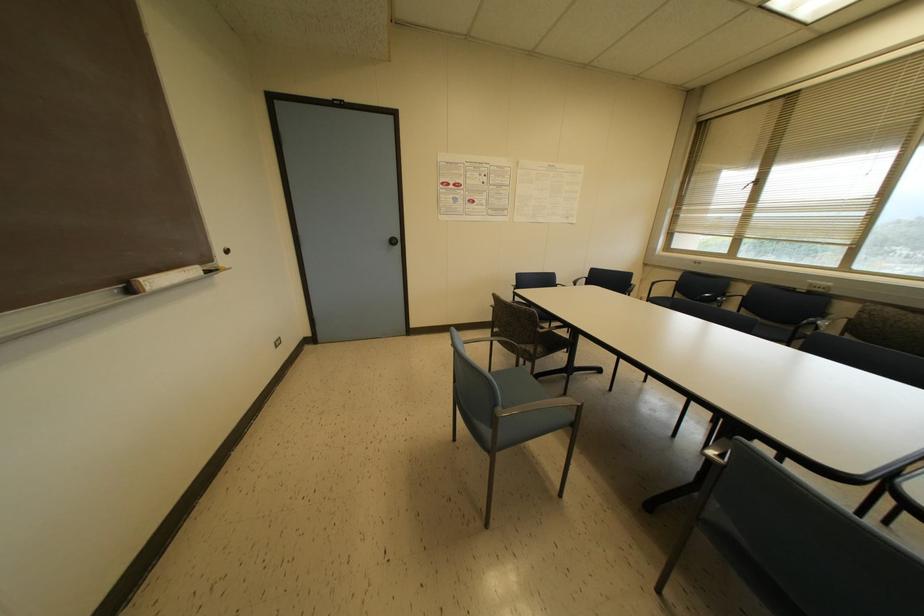
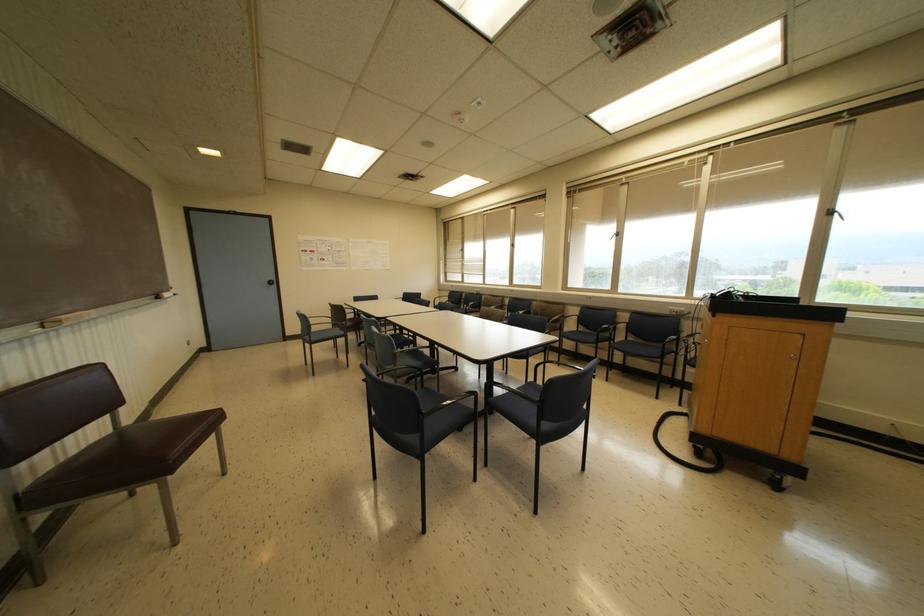
The point at [130,290] is marked in the first image. Where is the corresponding point in the second image?

(157, 297)